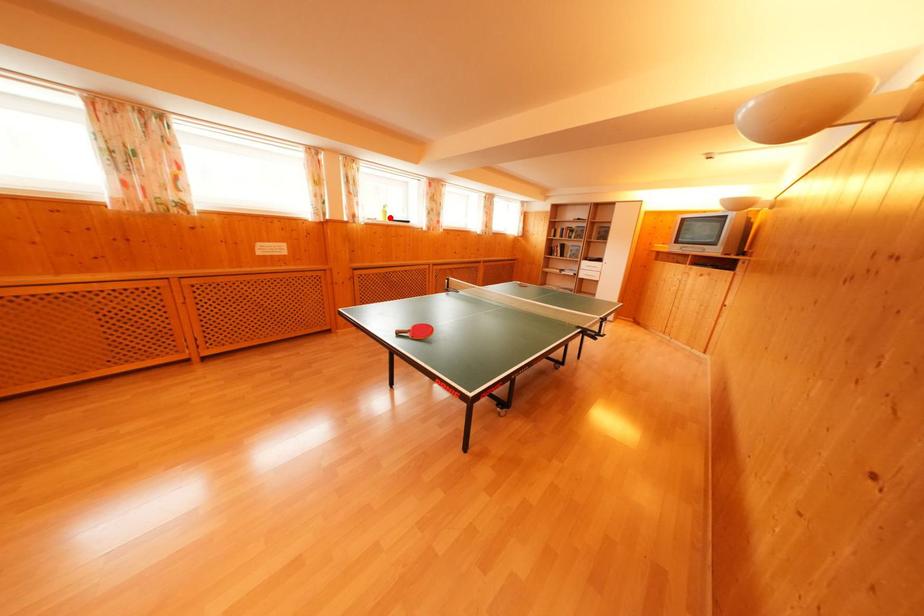
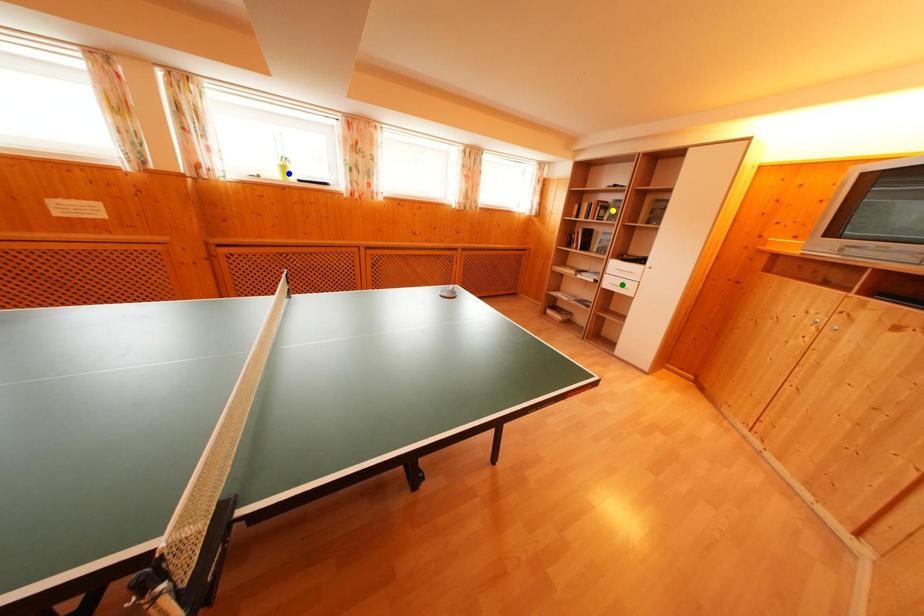
Question: I am providing you with two images of the same scene from different viewpoints. A red point is marked on the first image. You are given multiple points on the second image. Which spot in image 2 lines up with the point in image 1?

Choices:
 (A) yellow point
 (B) blue point
 (C) green point

Answer: (B)